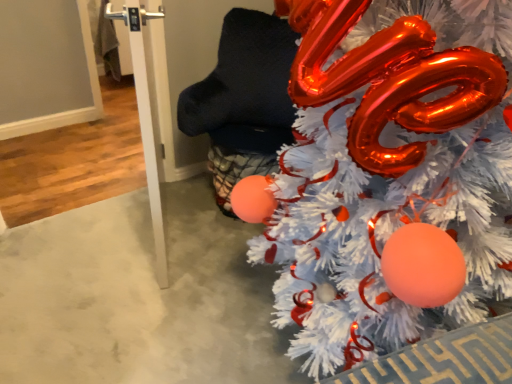
This screenshot has height=384, width=512. I want to click on free spot in front of white glossy door handle at left, so click(x=128, y=306).